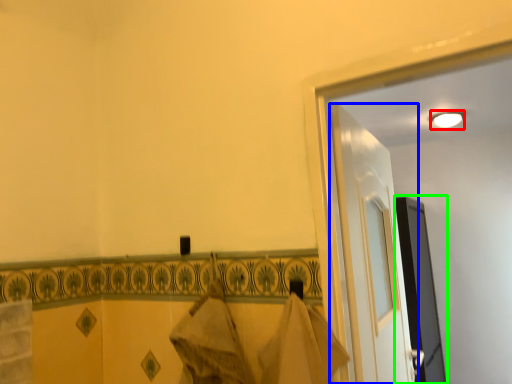
Question: Considering the real-world distances, which object is farthest from light (highlighted by a red box)? door (highlighted by a blue box) or screen door (highlighted by a green box)?

Choices:
 (A) door
 (B) screen door

Answer: (A)